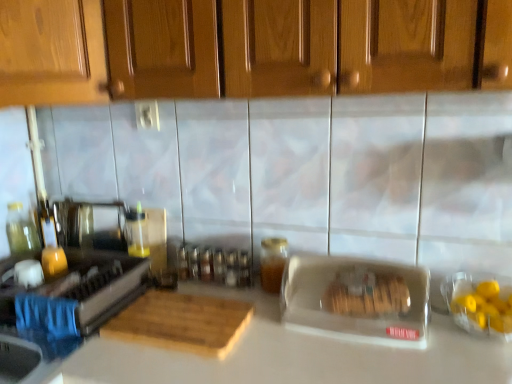
Question: Do you think stainless steel stove at left, arranged as the 2th appliance when viewed from the right, is within wooden cutting board at center, or outside of it?

Choices:
 (A) outside
 (B) inside

Answer: (A)

Question: Considering the relative positions of stainless steel stove at left, the 1th appliance from the left, and wooden cutting board at center in the image provided, is stainless steel stove at left, the 1th appliance from the left, to the left or to the right of wooden cutting board at center?

Choices:
 (A) right
 (B) left

Answer: (B)

Question: Considering the real-world distances, which object is closest to the wooden cabinet at upper center?

Choices:
 (A) stainless steel stove at left, the 1th appliance from the left
 (B) wooden cutting board at center
 (C) white matte countertop at center
 (D) clear plastic container at center, acting as the first appliance starting from the right

Answer: (D)

Question: Estimate the real-world distances between objects in this image. Which object is closer to the wooden cabinet at upper center?

Choices:
 (A) clear plastic container at center, acting as the first appliance starting from the right
 (B) white matte countertop at center
 (C) wooden cutting board at center
 (D) stainless steel stove at left, arranged as the 2th appliance when viewed from the right

Answer: (A)